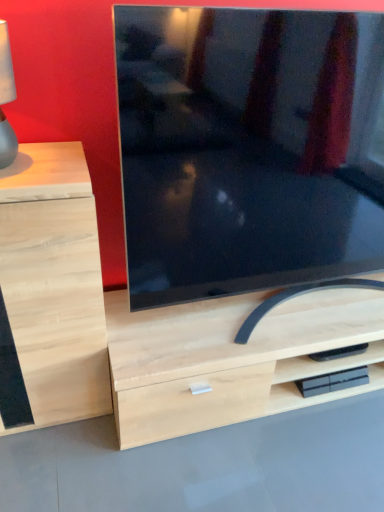
I want to click on free point above light wood drawer at left (from a real-world perspective), so click(x=40, y=160).